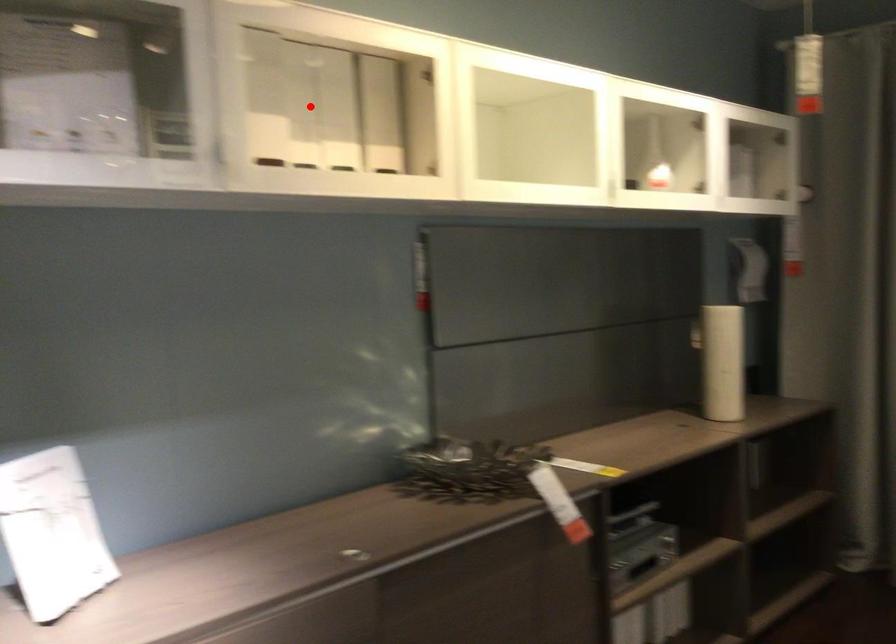
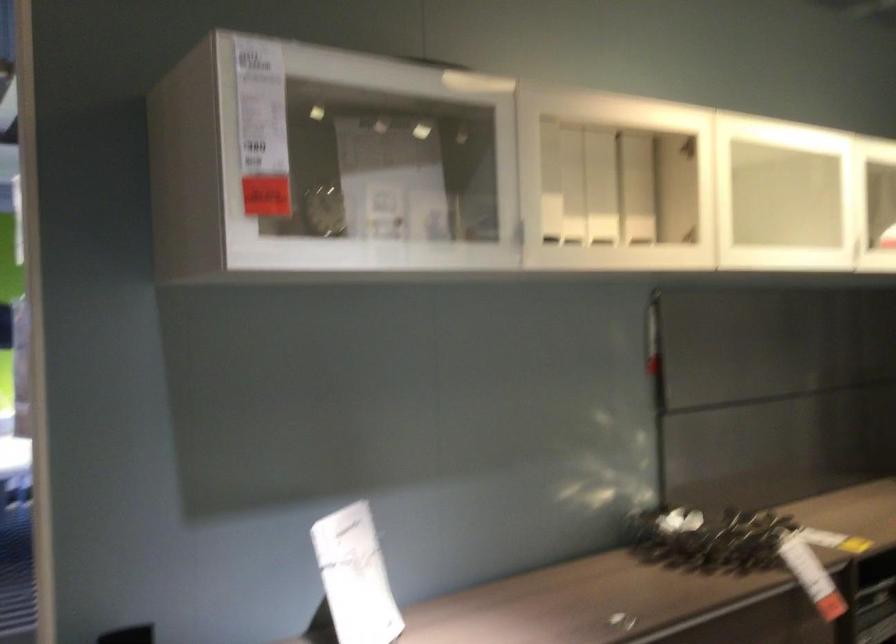
In the second image, find the point that corresponds to the highlighted location in the first image.

(573, 184)